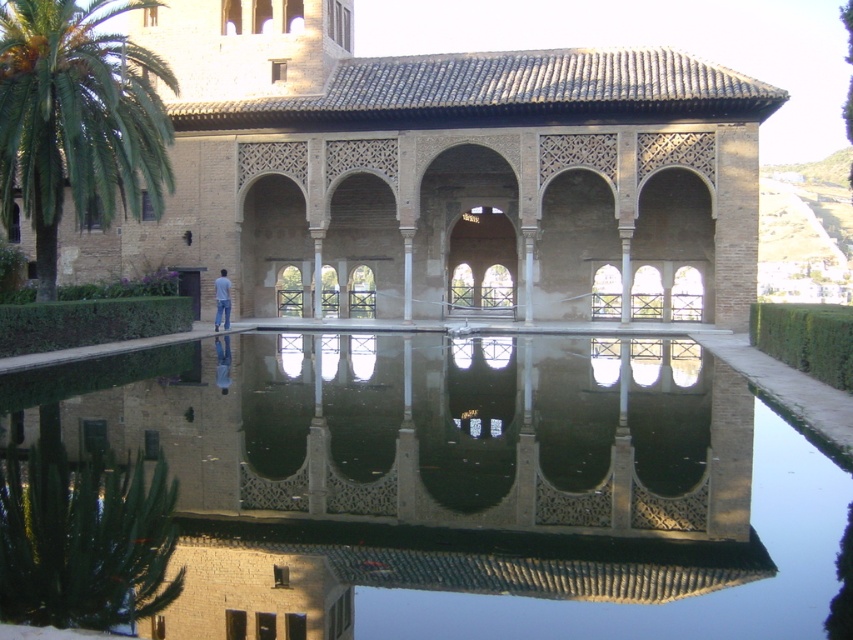
Question: Is clear glass water at center to the right of blue jeans at center from the viewer's perspective?

Choices:
 (A) yes
 (B) no

Answer: (A)

Question: Which point is closer to the camera?

Choices:
 (A) brown textured stone palace at center
 (B) green leafy palm tree at left
 (C) blue jeans at center
 (D) clear glass water at center

Answer: (D)

Question: Considering the relative positions of clear glass water at center and green leafy palm tree at left in the image provided, where is clear glass water at center located with respect to green leafy palm tree at left?

Choices:
 (A) right
 (B) left

Answer: (A)

Question: Which object is positioned closest to the green leafy palm tree at left?

Choices:
 (A) blue jeans at center
 (B) brown textured stone palace at center
 (C) clear glass water at center

Answer: (B)

Question: Can you confirm if clear glass water at center is positioned to the left of green leafy palm tree at left?

Choices:
 (A) yes
 (B) no

Answer: (B)

Question: Which of these objects is positioned closest to the brown textured stone palace at center?

Choices:
 (A) green leafy palm tree at left
 (B) blue jeans at center
 (C) clear glass water at center

Answer: (A)